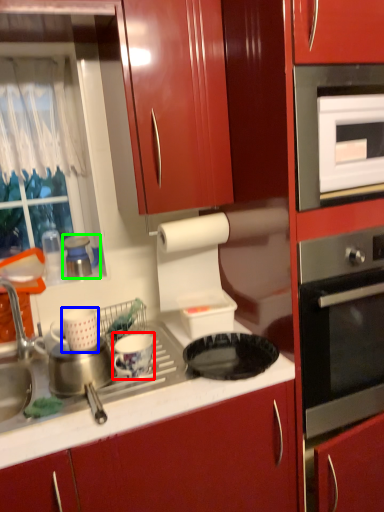
Question: Estimate the real-world distances between objects in this image. Which object is farther from appliance (highlighted by a red box), appliance (highlighted by a blue box) or appliance (highlighted by a green box)?

Choices:
 (A) appliance
 (B) appliance

Answer: (B)